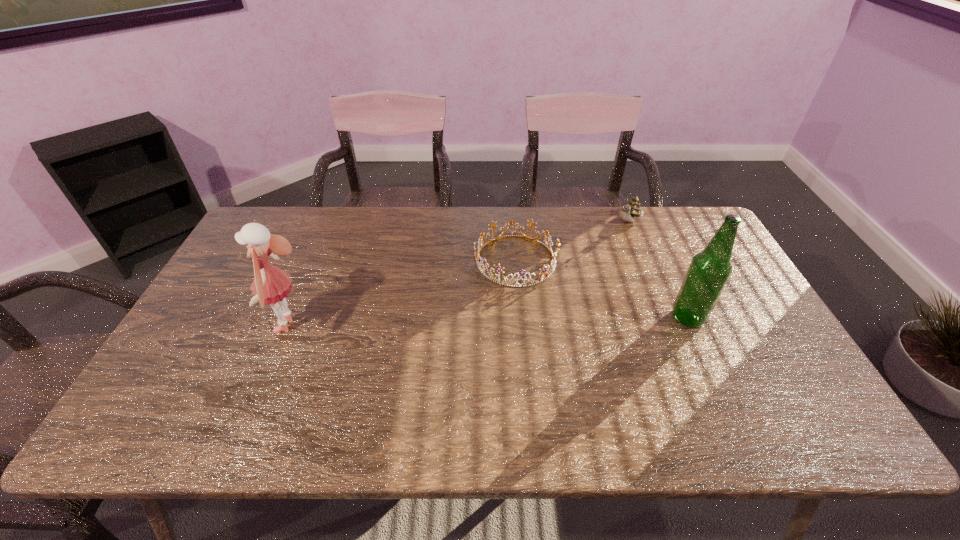
Image resolution: width=960 pixels, height=540 pixels. Identify the location of free spot between the shortest object and the beer bottle. (602, 289).

Find the location of a particular element. The height and width of the screenshot is (540, 960). vacant point located between the doll and the farthest object is located at coordinates (460, 274).

Image resolution: width=960 pixels, height=540 pixels. What are the coordinates of `empty space between the beer bottle and the snail` in the screenshot? It's located at (659, 269).

Where is `free space between the second shortest object and the leftmost object`? free space between the second shortest object and the leftmost object is located at coordinates (460, 274).

Where is `vacant area that lies between the snail and the shortest object`? vacant area that lies between the snail and the shortest object is located at coordinates 572,241.

Locate an element on the screen. The height and width of the screenshot is (540, 960). free spot between the tiara and the leftmost object is located at coordinates (403, 293).

Identify the location of free spot between the snail and the doll. The width and height of the screenshot is (960, 540). (460, 274).

Locate an element on the screen. Image resolution: width=960 pixels, height=540 pixels. vacant space that's between the leftmost object and the snail is located at coordinates (460, 274).

Find the location of a particular element. The width and height of the screenshot is (960, 540). object that stands as the second closest to the second object from left to right is located at coordinates (710, 269).

Identify which object is the third nearest to the snail. Please provide its 2D coordinates. Your answer should be formatted as a tuple, i.e. [(x, y)], where the tuple contains the x and y coordinates of a point satisfying the conditions above.

[(271, 285)]